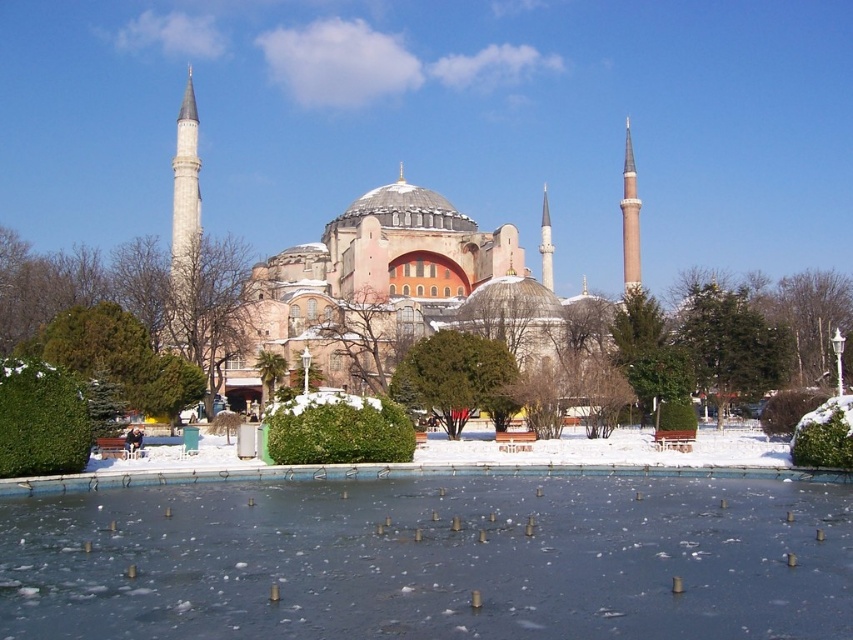
Question: Where is white marble minaret at left located in relation to brown stone minaret at right in the image?

Choices:
 (A) above
 (B) below

Answer: (A)

Question: Observing the image, what is the correct spatial positioning of frozen glass lake at center in reference to brown stone minaret at right?

Choices:
 (A) left
 (B) right

Answer: (A)

Question: Can you confirm if white marble minaret at left is positioned to the left of smooth white minaret at center?

Choices:
 (A) yes
 (B) no

Answer: (A)

Question: Which of the following is the closest to the observer?

Choices:
 (A) (546, 269)
 (B) (630, 244)
 (C) (192, 236)

Answer: (C)

Question: Which point appears farthest from the camera in this image?

Choices:
 (A) (630, 164)
 (B) (172, 273)

Answer: (A)

Question: Which of these objects is positioned farthest from the white marble minaret at left?

Choices:
 (A) frozen glass lake at center
 (B) brown stone minaret at right
 (C) smooth white minaret at center

Answer: (C)